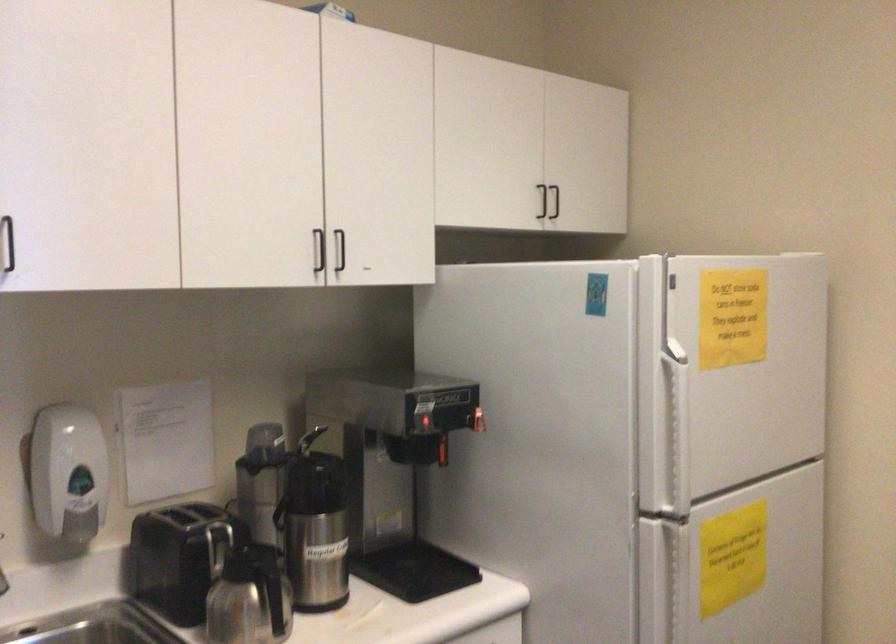
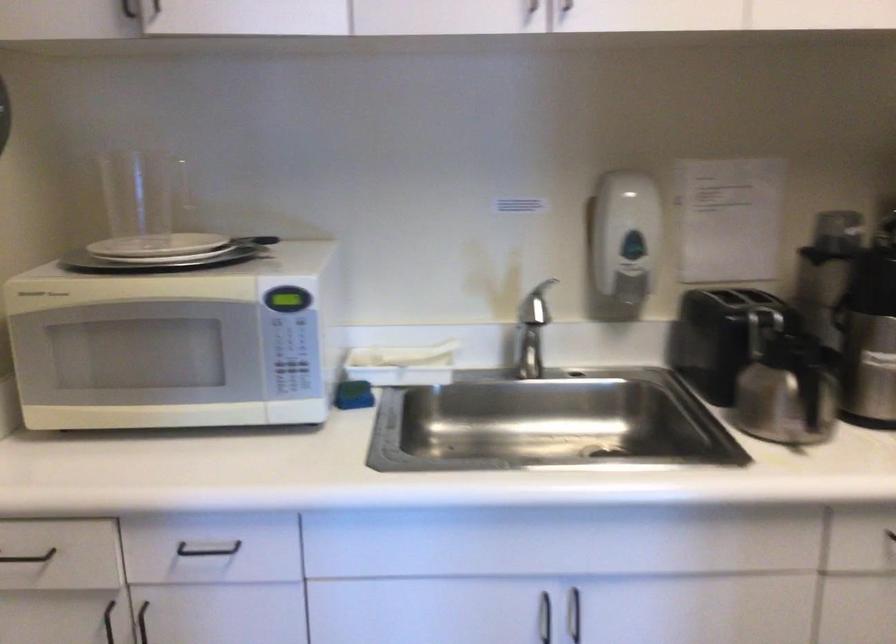
Where in the second image is the point corresponding to point (85, 524) from the first image?

(631, 288)